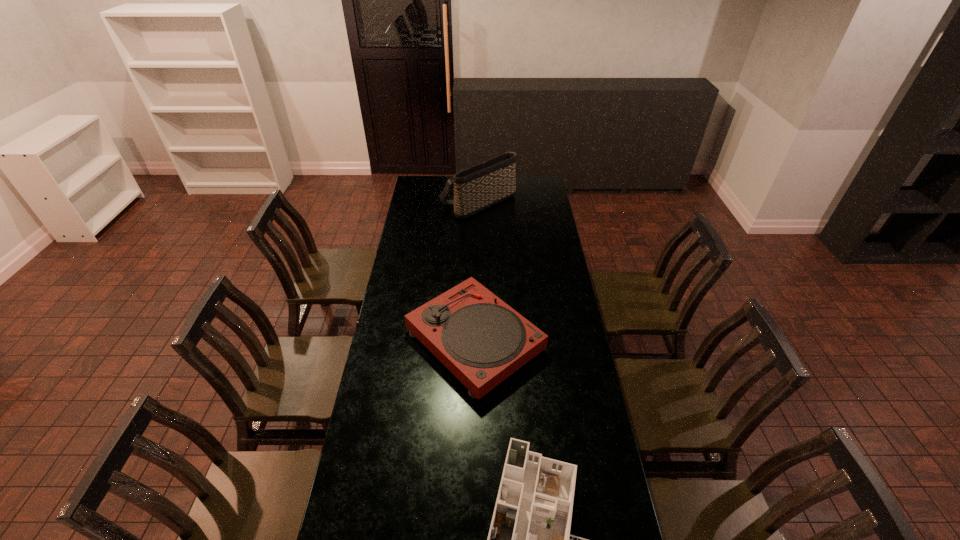
The width and height of the screenshot is (960, 540). Identify the location of free space at the right edge of the desktop. (540, 218).

In the image, there is a desktop. Where is `vacant space at the far right corner`? The height and width of the screenshot is (540, 960). vacant space at the far right corner is located at coordinates (522, 177).

Find the location of a particular element. Image resolution: width=960 pixels, height=540 pixels. free space that is in between the handbag and the second shortest object is located at coordinates (477, 272).

Locate which object ranks in proximity to the tallest object. Please provide its 2D coordinates. Your answer should be formatted as a tuple, i.e. [(x, y)], where the tuple contains the x and y coordinates of a point satisfying the conditions above.

[(481, 340)]

Identify which object is the closest to the farthest object. Please provide its 2D coordinates. Your answer should be formatted as a tuple, i.e. [(x, y)], where the tuple contains the x and y coordinates of a point satisfying the conditions above.

[(481, 340)]